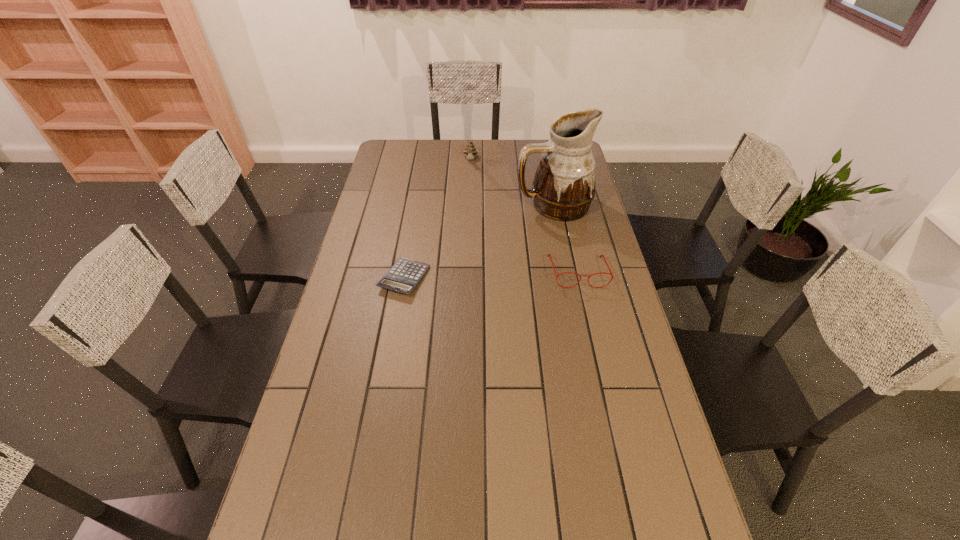
Find the location of a particular element. This screenshot has width=960, height=540. vacant space situated from the spout of the pitcher is located at coordinates (504, 244).

I want to click on vacant position located from the spout of the pitcher, so click(x=491, y=256).

Locate an element on the screen. The width and height of the screenshot is (960, 540). vacant space located on the face of the farthest object is located at coordinates (469, 208).

This screenshot has width=960, height=540. I want to click on free space located on the face of the farthest object, so click(x=469, y=195).

Where is `vacant space situated on the face of the farthest object`? This screenshot has width=960, height=540. vacant space situated on the face of the farthest object is located at coordinates (469, 210).

At what (x,y) coordinates should I click in order to perform the action: click on object present at the far edge. Please return your answer as a coordinate pair (x, y). The width and height of the screenshot is (960, 540). Looking at the image, I should click on (470, 150).

I want to click on object positioned at the left edge, so click(403, 277).

I want to click on spectacles positioned at the right edge, so click(600, 256).

Locate an element on the screen. The width and height of the screenshot is (960, 540). pitcher that is at the right edge is located at coordinates (563, 188).

The height and width of the screenshot is (540, 960). In the image, there is a desktop. In order to click on vacant region at the far edge in this screenshot , I will do `click(432, 153)`.